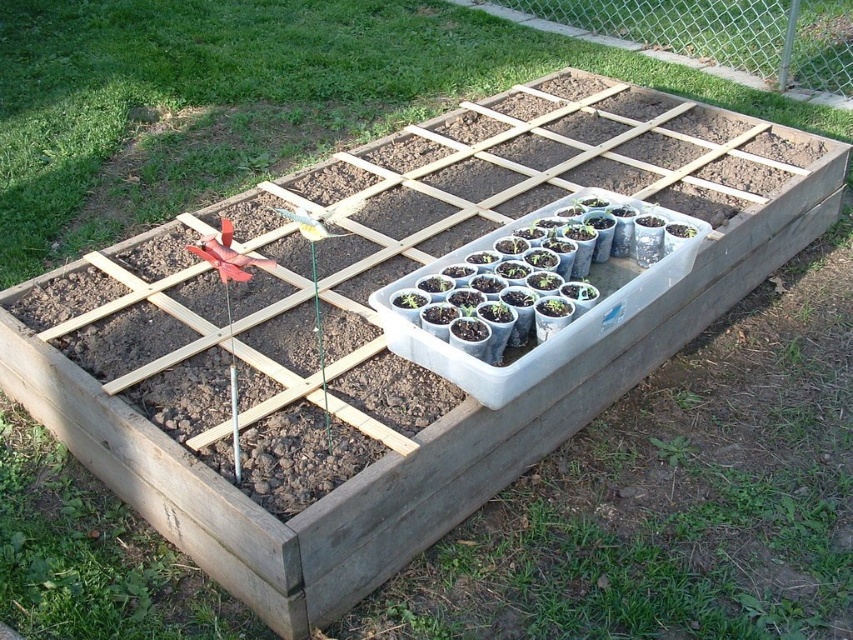
Question: Considering the relative positions of matte plastic tray at center and clear plastic tray of seedlings at center in the image provided, where is matte plastic tray at center located with respect to clear plastic tray of seedlings at center?

Choices:
 (A) left
 (B) right

Answer: (A)

Question: Which object is farther from the camera taking this photo?

Choices:
 (A) clear plastic tray of seedlings at center
 (B) matte plastic tray at center

Answer: (B)

Question: Which of the following is the closest to the observer?

Choices:
 (A) matte plastic tray at center
 (B) clear plastic tray of seedlings at center

Answer: (B)

Question: Does matte plastic tray at center lie in front of clear plastic tray of seedlings at center?

Choices:
 (A) yes
 (B) no

Answer: (B)

Question: Is matte plastic tray at center to the right of clear plastic tray of seedlings at center from the viewer's perspective?

Choices:
 (A) no
 (B) yes

Answer: (A)